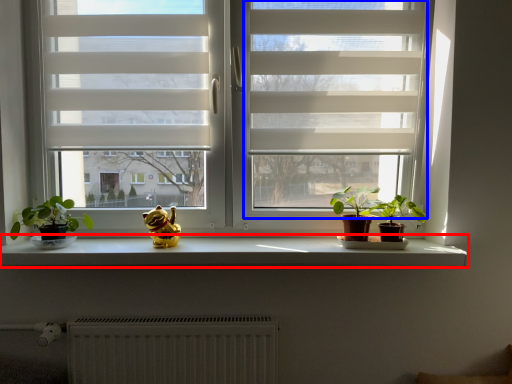
Question: Which object appears farthest to the camera in this image, window sill (highlighted by a red box) or screen door (highlighted by a blue box)?

Choices:
 (A) window sill
 (B) screen door

Answer: (A)